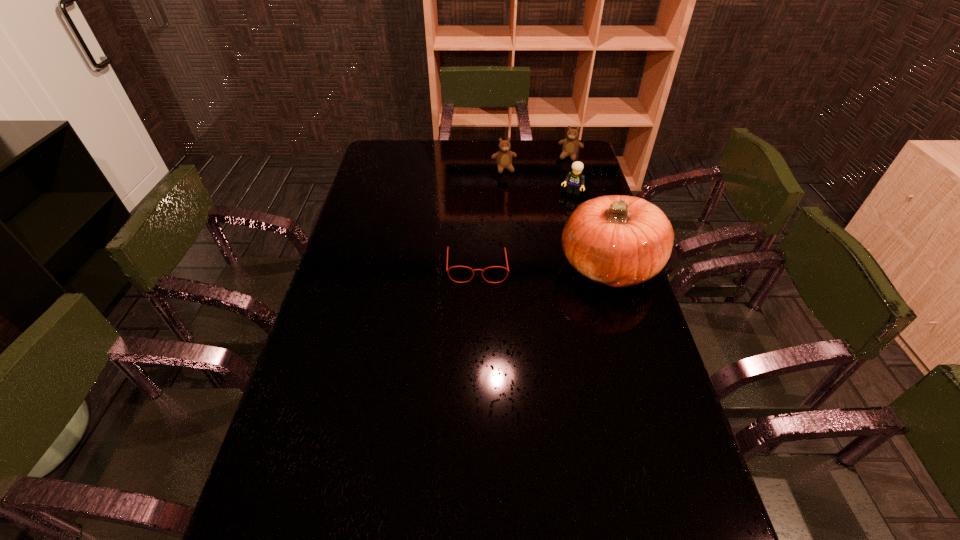
Where is `spectacles`? This screenshot has height=540, width=960. spectacles is located at coordinates 448,248.

This screenshot has height=540, width=960. Identify the location of the tallest object. (616, 240).

Where is `the left teddy bear`? the left teddy bear is located at coordinates (503, 157).

Where is `the fourth nearest object`? This screenshot has width=960, height=540. the fourth nearest object is located at coordinates (503, 157).

Image resolution: width=960 pixels, height=540 pixels. What are the coordinates of `the right teddy bear` in the screenshot? It's located at point(570,147).

I want to click on the farthest object, so click(x=570, y=147).

In order to click on the third farthest object in this screenshot , I will do `click(575, 178)`.

Find the location of a particular element. This screenshot has width=960, height=540. blank space located 0.370m on the face of the spectacles is located at coordinates (476, 392).

At what (x,y) coordinates should I click in order to perform the action: click on vacant space located 0.260m on the left of the tallest object. Please return your answer as a coordinate pair (x, y). The height and width of the screenshot is (540, 960). Looking at the image, I should click on (475, 265).

Find the location of a particular element. Image resolution: width=960 pixels, height=540 pixels. free region located 0.170m at the face of the fourth nearest object is located at coordinates (516, 199).